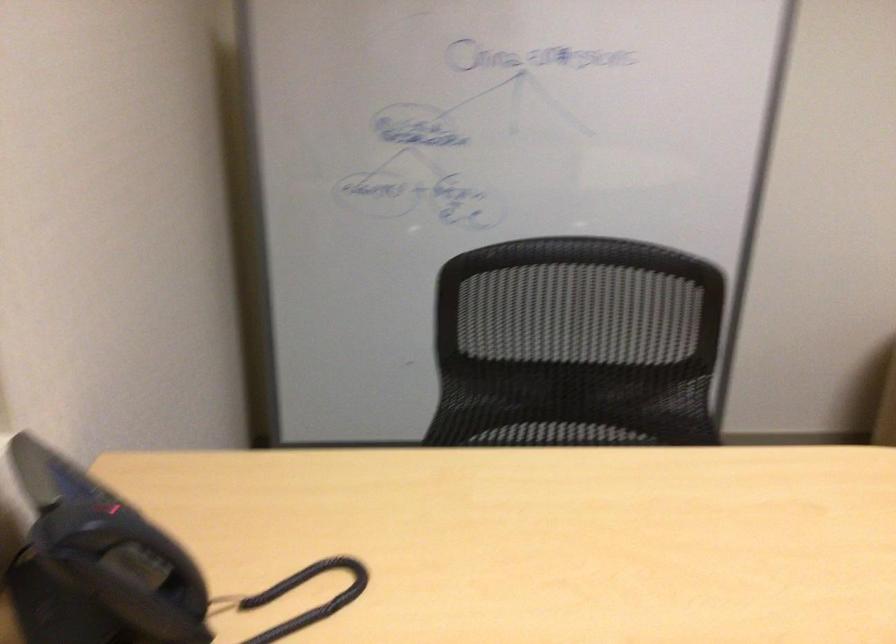
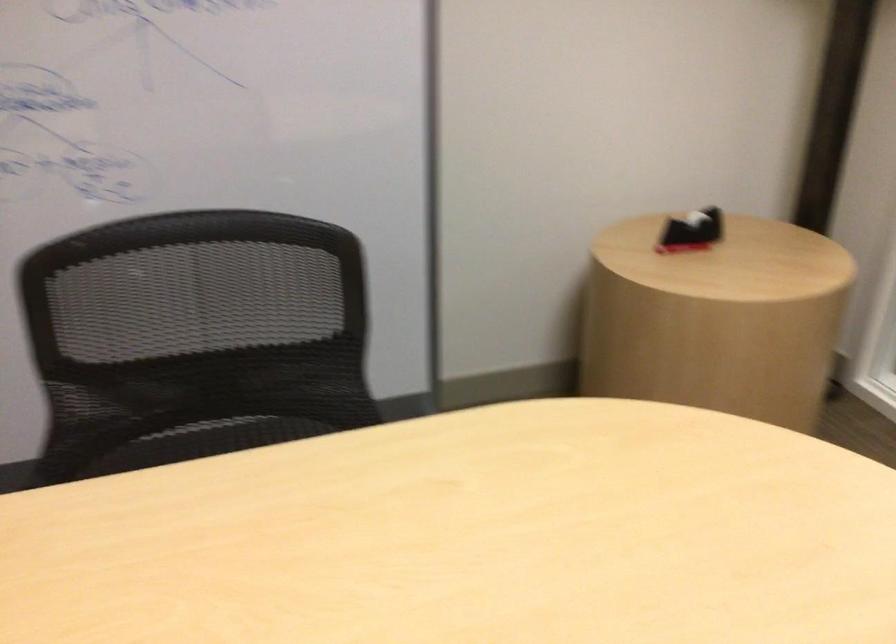
In the scene shown: What movement of the cameraman would produce the second image?

The cameraman moved toward right, forward.